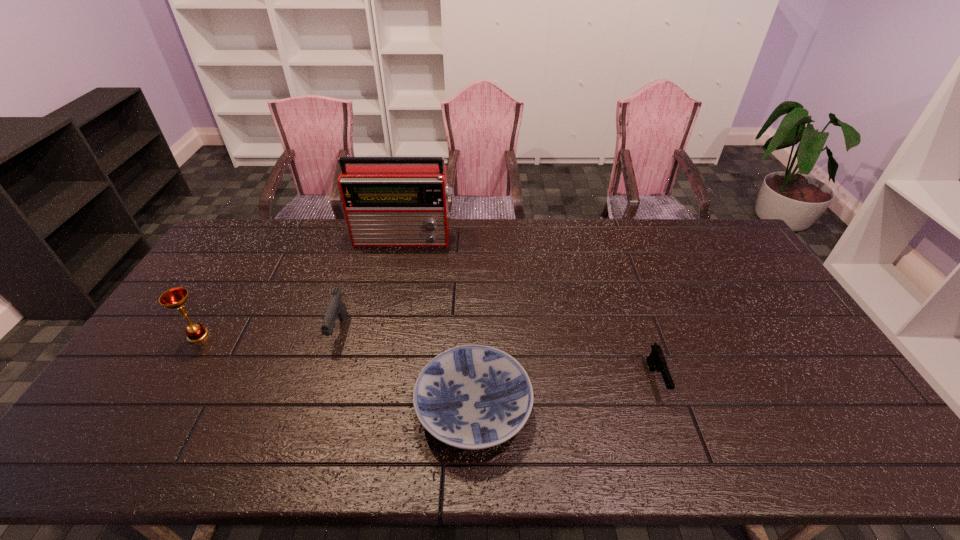
At what (x,y) coordinates should I click in order to perform the action: click on the tallest object. Please return your answer as a coordinate pair (x, y). This screenshot has height=540, width=960. Looking at the image, I should click on (388, 201).

Locate an element on the screen. Image resolution: width=960 pixels, height=540 pixels. the farthest object is located at coordinates (388, 201).

Image resolution: width=960 pixels, height=540 pixels. In order to click on the fourth shortest object in this screenshot , I will do `click(175, 298)`.

Locate an element on the screen. This screenshot has width=960, height=540. the leftmost object is located at coordinates (175, 298).

The width and height of the screenshot is (960, 540). In order to click on the left pistol in this screenshot , I will do `click(336, 307)`.

Locate an element on the screen. the third tallest object is located at coordinates (336, 307).

I want to click on the rightmost object, so click(656, 361).

The image size is (960, 540). Identify the location of the nearer pistol. (656, 361).

Where is `plate`? This screenshot has width=960, height=540. plate is located at coordinates (472, 397).

You are a GUI agent. You are given a task and a screenshot of the screen. Output one action in this format:
    pyautogui.click(x=<x>, y=<y>)
    Task: Click on the blank space located 0.290m on the front-facing side of the tallest object
    The height and width of the screenshot is (540, 960).
    Given the screenshot: What is the action you would take?
    pyautogui.click(x=391, y=306)